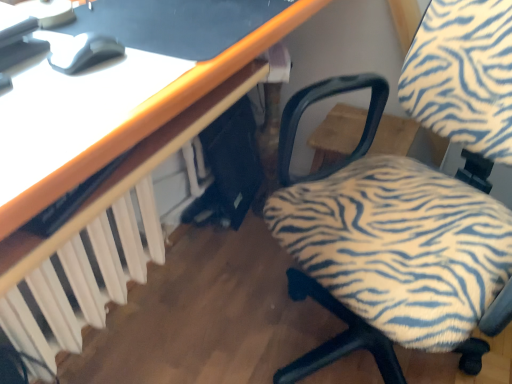
I want to click on blank area beneath white plastic radiator at lower left (from a real-world perspective), so click(128, 345).